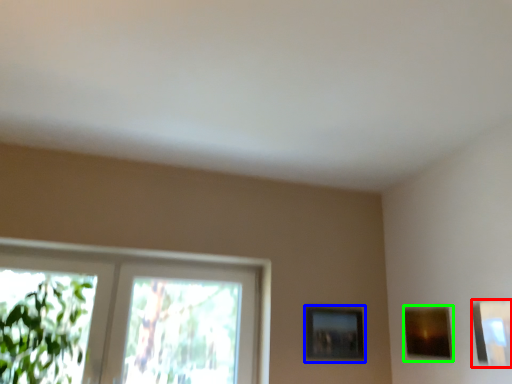
Question: Which object is positioned closest to picture frame (highlighted by a red box)? Select from picture frame (highlighted by a blue box) and picture frame (highlighted by a green box).

Choices:
 (A) picture frame
 (B) picture frame

Answer: (B)